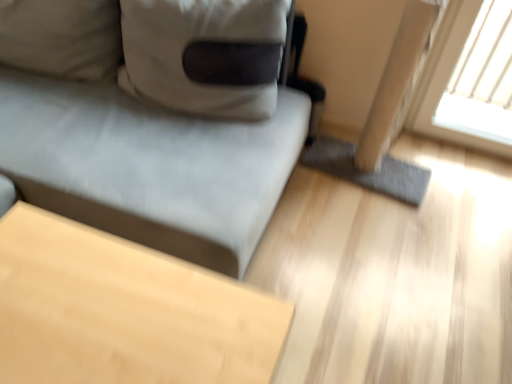
Question: Is light wood table at lower left oriented away from suede-like gray couch at upper left?

Choices:
 (A) no
 (B) yes

Answer: (A)

Question: Is the depth of light wood table at lower left greater than that of suede-like gray couch at upper left?

Choices:
 (A) yes
 (B) no

Answer: (B)

Question: Is light wood table at lower left bigger than suede-like gray couch at upper left?

Choices:
 (A) no
 (B) yes

Answer: (A)

Question: Is light wood table at lower left closer to camera compared to suede-like gray couch at upper left?

Choices:
 (A) no
 (B) yes

Answer: (B)

Question: Is light wood table at lower left to the right of suede-like gray couch at upper left from the viewer's perspective?

Choices:
 (A) yes
 (B) no

Answer: (A)

Question: Is light wood table at lower left taller than suede-like gray couch at upper left?

Choices:
 (A) yes
 (B) no

Answer: (B)

Question: Is suede-like gray couch at upper left aimed at light wood table at lower left?

Choices:
 (A) no
 (B) yes

Answer: (B)

Question: From the image's perspective, is suede-like gray couch at upper left under light wood table at lower left?

Choices:
 (A) yes
 (B) no

Answer: (B)

Question: Is suede-like gray couch at upper left wider than light wood table at lower left?

Choices:
 (A) no
 (B) yes

Answer: (B)

Question: From a real-world perspective, is suede-like gray couch at upper left located beneath light wood table at lower left?

Choices:
 (A) yes
 (B) no

Answer: (B)

Question: Is light wood table at lower left at the back of suede-like gray couch at upper left?

Choices:
 (A) no
 (B) yes

Answer: (A)

Question: Does suede-like gray couch at upper left appear on the left side of light wood table at lower left?

Choices:
 (A) no
 (B) yes

Answer: (B)

Question: Would you say suede-like gray couch at upper left is to the left or to the right of light wood table at lower left in the picture?

Choices:
 (A) right
 (B) left

Answer: (B)